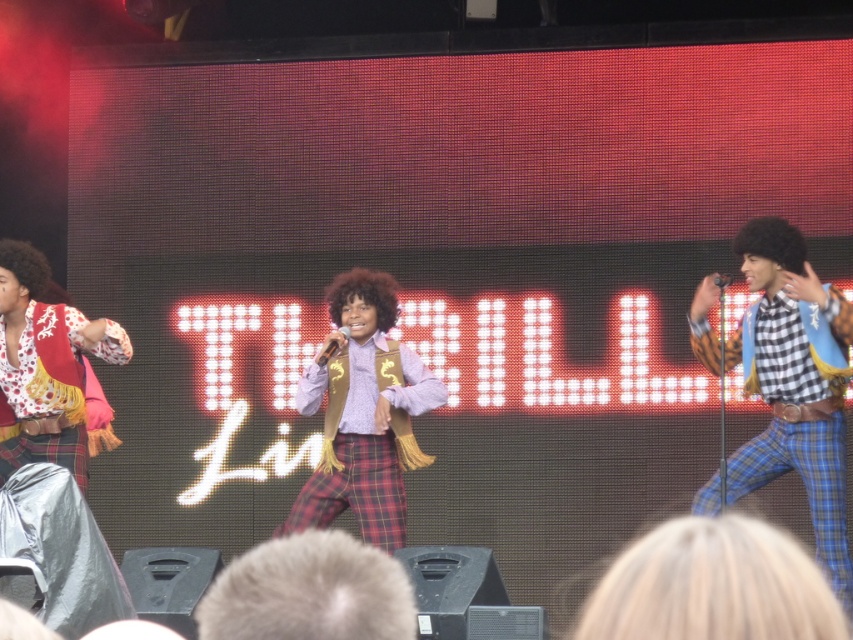
You are a photographer at the concert and want to capture a photo where both the checkered fabric pants at right and the afro at right are clearly visible. Based on their sizes, which object should you focus on to ensure both are in frame?

The checkered fabric pants at right is taller than the afro at right, so focusing on the checkered fabric pants at right would ensure both are in frame as it occupies more vertical space.